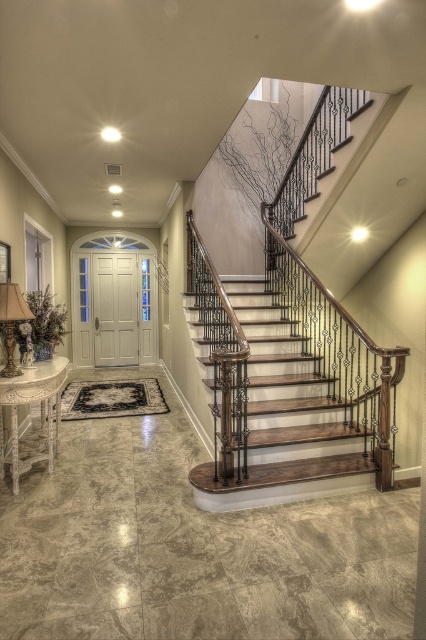
Question: Is wooden stairs at center to the right of matte gold lamp at lower left from the viewer's perspective?

Choices:
 (A) no
 (B) yes

Answer: (B)

Question: Which point appears closest to the camera in this image?

Choices:
 (A) (14, 342)
 (B) (353, 444)

Answer: (A)

Question: Among these points, which one is nearest to the camera?

Choices:
 (A) (339, 408)
 (B) (0, 371)

Answer: (B)

Question: Does wooden stairs at center appear over matte gold lamp at lower left?

Choices:
 (A) yes
 (B) no

Answer: (B)

Question: Which of the following is the farthest from the observer?

Choices:
 (A) (294, 339)
 (B) (5, 292)

Answer: (A)

Question: Does wooden stairs at center appear under matte gold lamp at lower left?

Choices:
 (A) yes
 (B) no

Answer: (A)